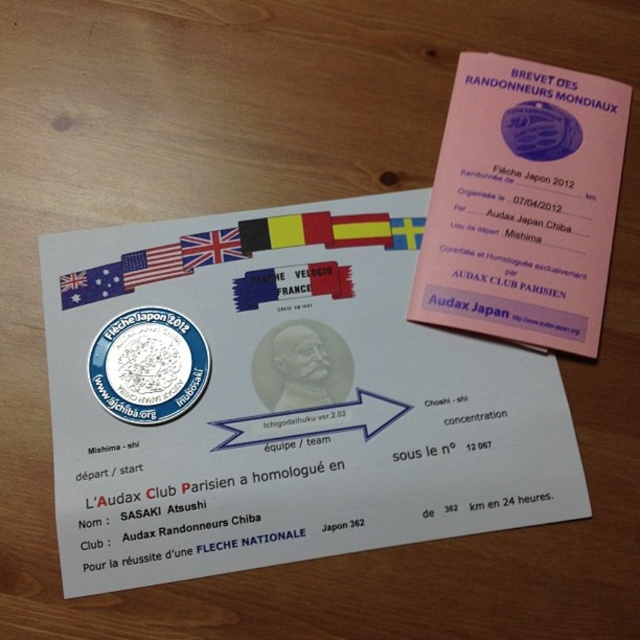
Question: Is silver metallic coin at center to the right of british flag at center from the viewer's perspective?

Choices:
 (A) yes
 (B) no

Answer: (B)

Question: Among these points, which one is nearest to the camera?

Choices:
 (A) (221, 260)
 (B) (60, 340)

Answer: (B)

Question: Which is nearer to the silver metallic coin at center?

Choices:
 (A) white fabric flag at upper left
 (B) white paper at upper center
 (C) british flag at center

Answer: (A)

Question: Is white paper at upper center closer to the viewer compared to british flag at center?

Choices:
 (A) no
 (B) yes

Answer: (B)

Question: Estimate the real-world distances between objects in this image. Which object is farther from the british flag at center?

Choices:
 (A) white paper at upper center
 (B) pink paper at upper right
 (C) white fabric flag at upper left
 (D) american flag at upper left

Answer: (B)

Question: In this image, where is white paper at upper center located relative to silver metallic coin at center?

Choices:
 (A) left
 (B) right

Answer: (B)